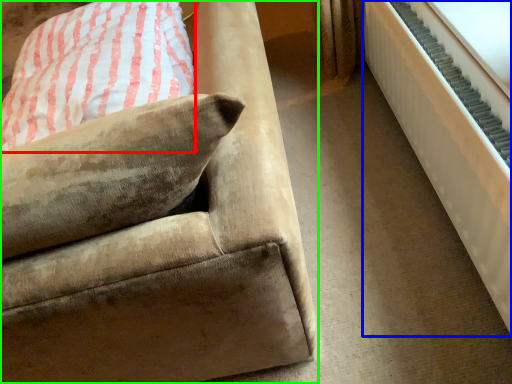
Question: Which is farther away from pillow (highlighted by a red box)? radiator (highlighted by a blue box) or studio couch (highlighted by a green box)?

Choices:
 (A) radiator
 (B) studio couch

Answer: (A)